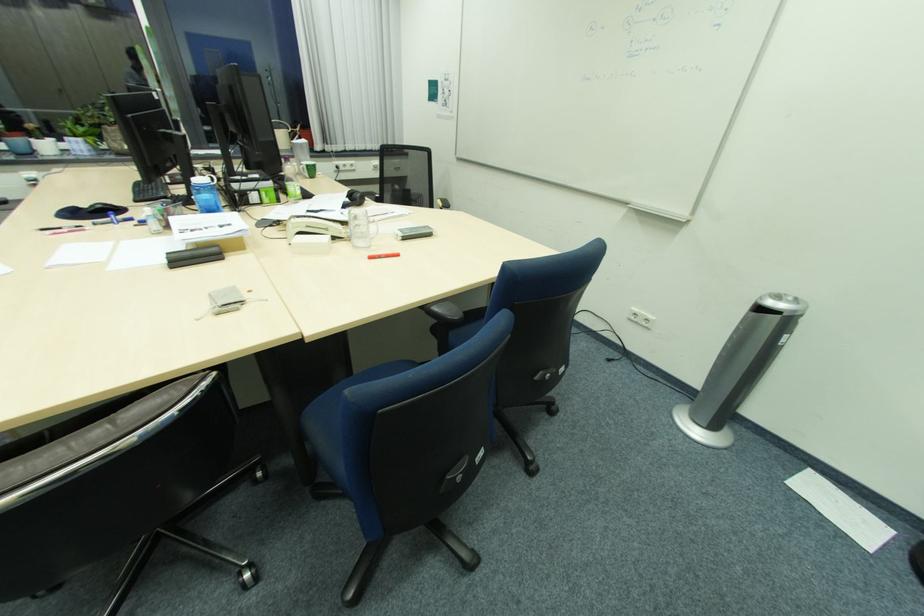
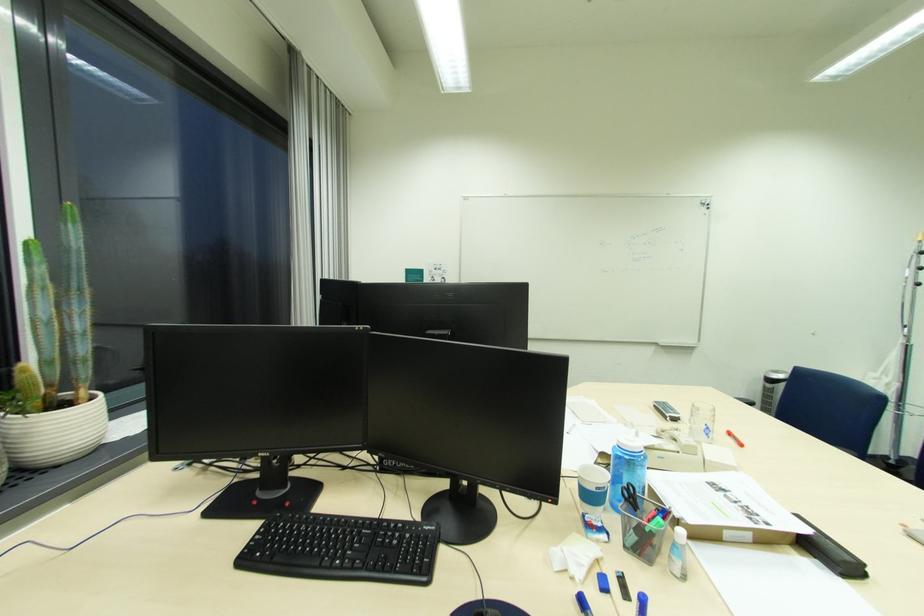
Locate, in the second image, the point that corresponds to pixel 404 254 in the first image.

(736, 435)